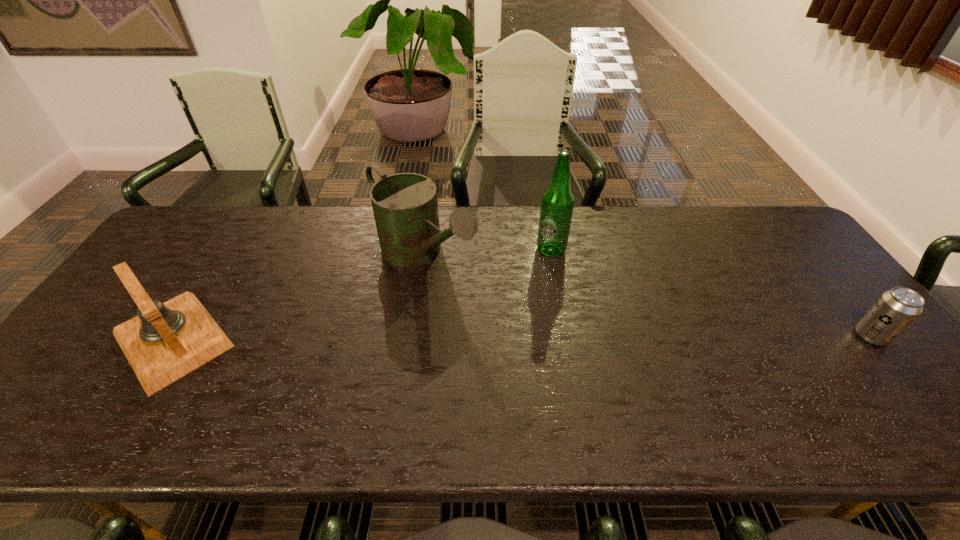
Identify which object is the second closest to the leftmost object. Please provide its 2D coordinates. Your answer should be formatted as a tuple, i.e. [(x, y)], where the tuple contains the x and y coordinates of a point satisfying the conditions above.

[(557, 202)]

At what (x,y) coordinates should I click in order to perform the action: click on free space that satisfies the following two spatial constraints: 1. on the back side of the shortest object; 2. on the left side of the leftmost object. Please return your answer as a coordinate pair (x, y). The image size is (960, 540). Looking at the image, I should click on (175, 336).

The width and height of the screenshot is (960, 540). I want to click on free spot that satisfies the following two spatial constraints: 1. on the front side of the beer can; 2. on the right side of the third object from left to right, so click(566, 336).

Find the location of `free location that satisfies the following two spatial constraints: 1. on the front side of the third object from left to right; 2. on the right side of the beer can`. free location that satisfies the following two spatial constraints: 1. on the front side of the third object from left to right; 2. on the right side of the beer can is located at coordinates (566, 336).